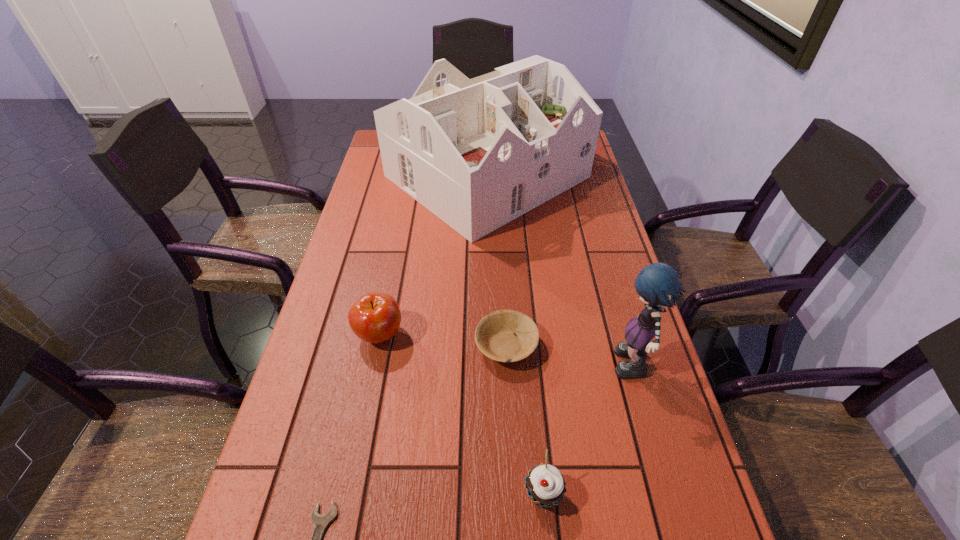
Identify the location of free space between the bowl and the rag doll. (569, 358).

The image size is (960, 540). In order to click on free spot between the apple and the cupcake in this screenshot , I will do `click(461, 414)`.

Locate an element on the screen. unoccupied area between the apple and the bowl is located at coordinates (443, 340).

Locate an element on the screen. free point between the rag doll and the fifth tallest object is located at coordinates (569, 358).

Where is `vacant point located between the dollhouse and the rag doll`? The height and width of the screenshot is (540, 960). vacant point located between the dollhouse and the rag doll is located at coordinates (560, 273).

The image size is (960, 540). I want to click on object that stands as the fourth closest to the fifth tallest object, so click(478, 153).

Identify which object is the third closest to the apple. Please provide its 2D coordinates. Your answer should be formatted as a tuple, i.e. [(x, y)], where the tuple contains the x and y coordinates of a point satisfying the conditions above.

[(320, 522)]

The height and width of the screenshot is (540, 960). I want to click on free location that satisfies the following two spatial constraints: 1. on the back side of the apple; 2. on the right side of the dollhouse, so click(411, 177).